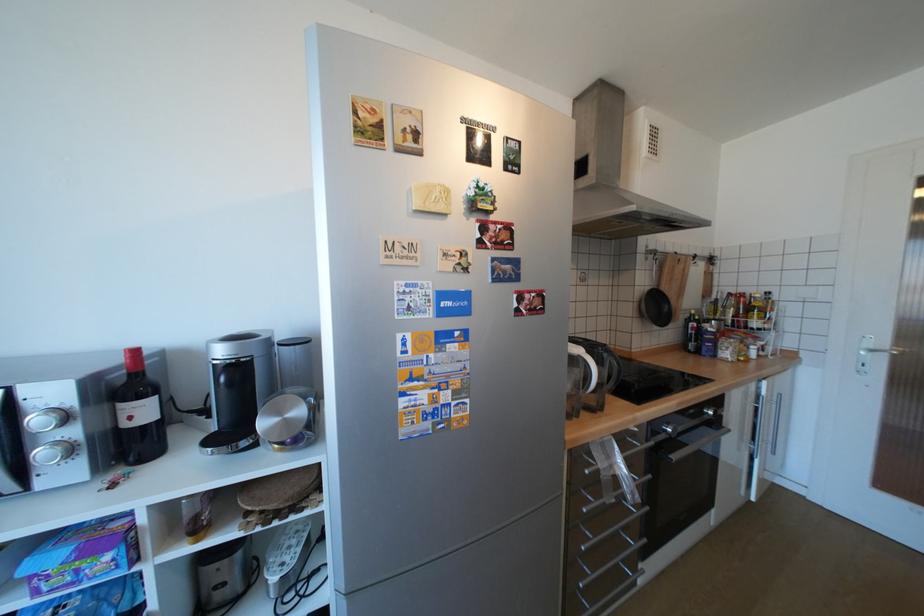
Image resolution: width=924 pixels, height=616 pixels. Identify the location of silver coffee machine lid. (287, 419).